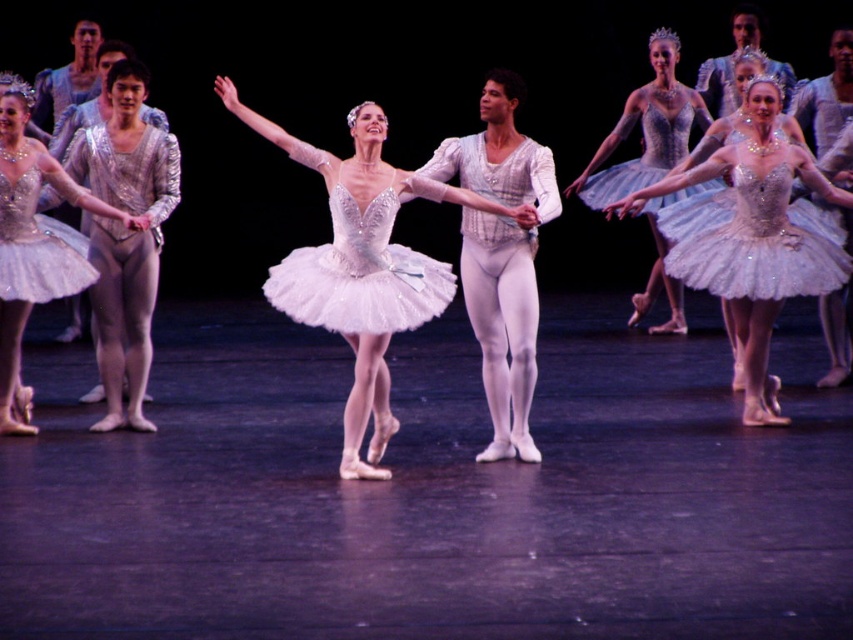
Between matte silver tutu at left and silver sequined tutu at upper right, which one is positioned higher?

Positioned higher is silver sequined tutu at upper right.

Based on the photo, who is more forward, (53, 289) or (693, 99)?

Positioned in front is point (53, 289).

Which is behind, point (26, 202) or point (614, 179)?

The point (614, 179) is more distant.

Identify the location of matte silver tutu at left. (33, 243).

Which is in front, point (381, 198) or point (341, 288)?

Positioned in front is point (341, 288).

Can you confirm if shiny silver tutu at center is shorter than white tulle tutu at center?

No, shiny silver tutu at center is not shorter than white tulle tutu at center.

Where is `shiny silver tutu at center`? This screenshot has width=853, height=640. shiny silver tutu at center is located at coordinates (363, 266).

Can you confirm if sparkling silver tutu at center is smaller than white tulle tutu at center?

No.

Is sparkling silver tutu at center to the right of white tulle tutu at center from the viewer's perspective?

Correct, you'll find sparkling silver tutu at center to the right of white tulle tutu at center.

In order to click on sparkling silver tutu at center in this screenshot , I will do `click(752, 237)`.